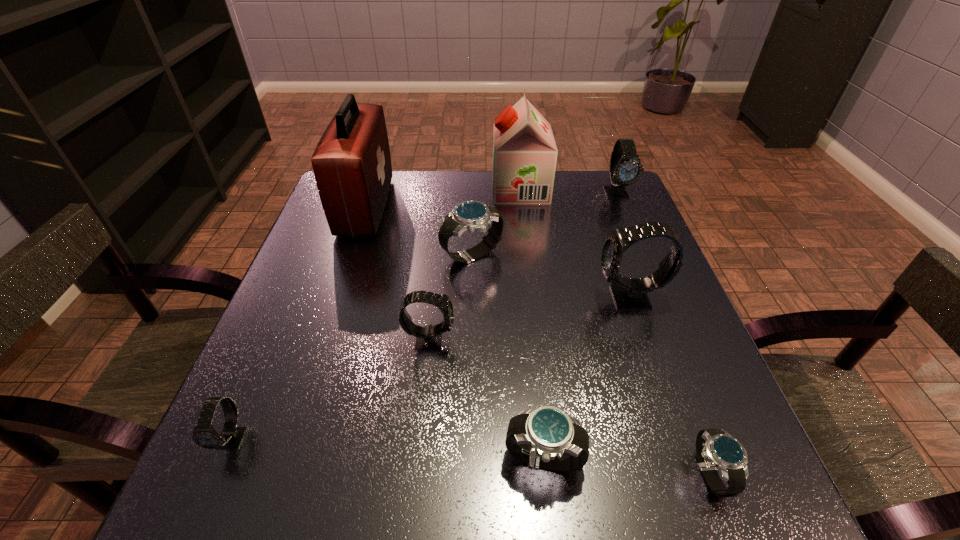
This screenshot has height=540, width=960. In the image, there is a desktop. Identify the location of vacant space at the left edge. coord(346,309).

At what (x,y) coordinates should I click in order to perform the action: click on free space at the right edge. Please return your answer as a coordinate pair (x, y). Looking at the image, I should click on (658, 360).

This screenshot has width=960, height=540. Find the location of `free region at the near left corner of the desktop`. free region at the near left corner of the desktop is located at coordinates click(x=243, y=498).

In the image, there is a desktop. What are the coordinates of `blank space at the far right corner` in the screenshot? It's located at (600, 206).

Locate an element on the screen. free point between the tallest watch and the second smallest silver watch is located at coordinates (587, 380).

This screenshot has height=540, width=960. In order to click on free space between the rightmost silver watch and the second biggest silver watch in this screenshot , I will do `click(626, 468)`.

This screenshot has width=960, height=540. I want to click on free space between the second biggest silver watch and the fifth nearest object, so click(587, 380).

Identify the location of free area in between the third farthest gray watch and the leftmost object. (331, 389).

You are a GUI agent. You are given a task and a screenshot of the screen. Output one action in this format:
    pyautogui.click(x=<x>, y=<y>)
    Task: Click on the vacant area that lies between the second object from left to right and the farthest gray watch
    
    Given the screenshot: What is the action you would take?
    pyautogui.click(x=492, y=200)

You are a GUI agent. You are given a task and a screenshot of the screen. Output one action in this format:
    pyautogui.click(x=<x>, y=<y>)
    Task: Click on the empty space that is in between the rightmost silver watch and the second biggest silver watch
    The height and width of the screenshot is (540, 960).
    Given the screenshot: What is the action you would take?
    pyautogui.click(x=626, y=468)